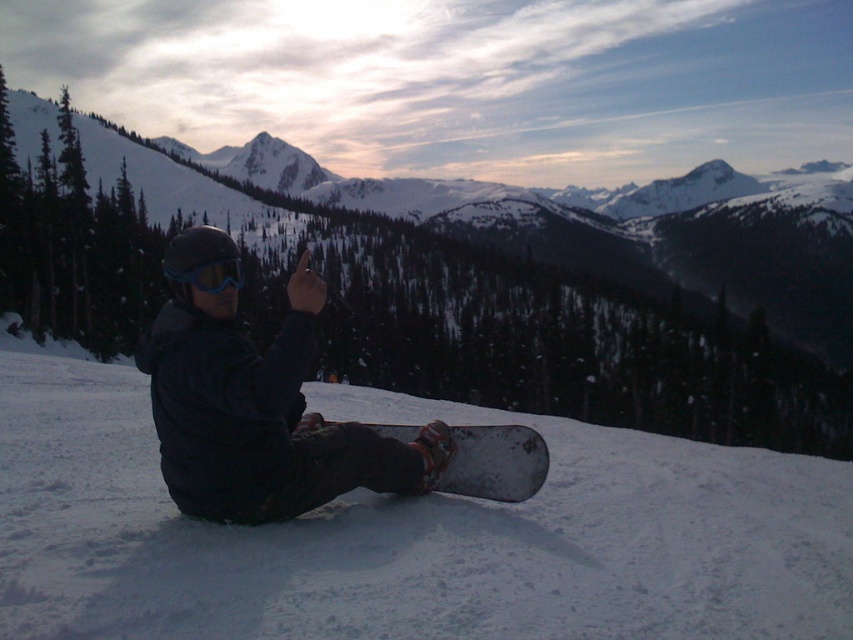
Question: In this image, where is white matte snowboard at center located relative to matte black snowboarder at center?

Choices:
 (A) below
 (B) above

Answer: (A)

Question: Which point is farther to the camera?

Choices:
 (A) (177, 269)
 (B) (132, 620)

Answer: (A)

Question: Which object is the farthest from the white matte snowboard at center?

Choices:
 (A) dark gray matte snowboard at lower center
 (B) matte blue goggles at center

Answer: (B)

Question: Is matte black snowboarder at center to the left of matte blue goggles at center from the viewer's perspective?

Choices:
 (A) no
 (B) yes

Answer: (A)

Question: Can you confirm if matte black snowboarder at center is positioned to the right of dark gray matte snowboard at lower center?

Choices:
 (A) yes
 (B) no

Answer: (B)

Question: Among these points, which one is farthest from the camera?

Choices:
 (A) (225, 308)
 (B) (540, 486)
 (C) (236, 259)
 (D) (125, 396)

Answer: (D)